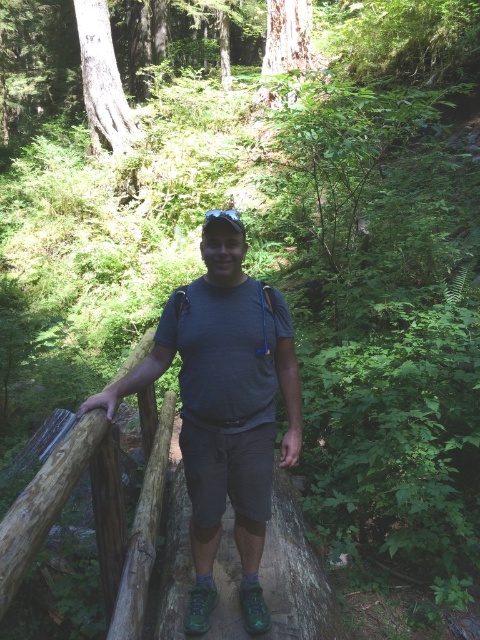
Question: Which point is closer to the camera?

Choices:
 (A) (x=290, y=461)
 (B) (x=158, y=493)
 (C) (x=216, y=570)

Answer: (A)

Question: Does gray matte t-shirt at center lie in front of green rubber shoes at center?

Choices:
 (A) no
 (B) yes

Answer: (B)

Question: Can you confirm if brown rough wood at left is positioned above green rubber shoes at center?

Choices:
 (A) no
 (B) yes

Answer: (B)

Question: Which object is positioned closest to the green rubber shoes at center?

Choices:
 (A) brown rough wood at left
 (B) gray matte t-shirt at center

Answer: (A)

Question: Which is nearer to the green rubber shoes at center?

Choices:
 (A) gray matte t-shirt at center
 (B) brown rough wood at left

Answer: (B)

Question: Where is brown rough wood at left located in relation to green rubber shoes at center in the image?

Choices:
 (A) left
 (B) right

Answer: (A)